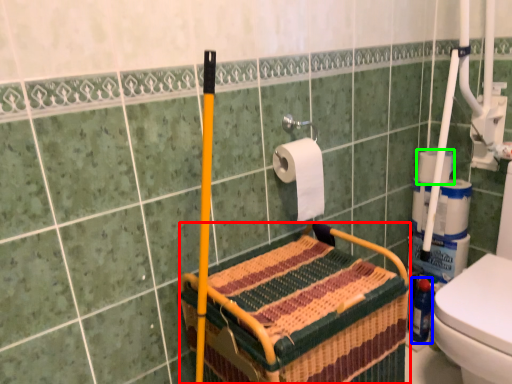
Question: Which object is the farthest from crate (highlighted by a red box)? Choose among these: bottle (highlighted by a blue box) or toilet paper (highlighted by a green box).

Choices:
 (A) bottle
 (B) toilet paper

Answer: (A)